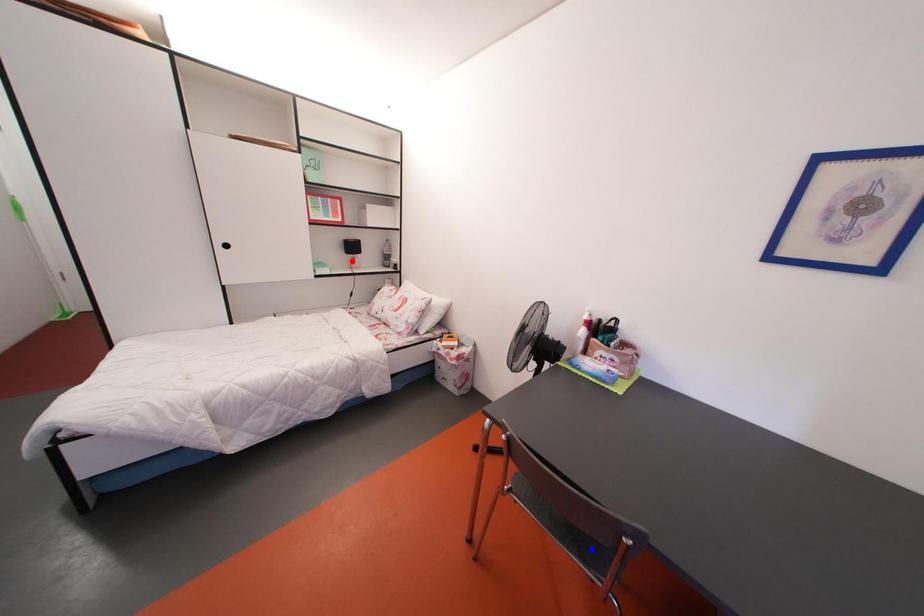
Question: In the image, two points are highlighted. Which point is nearer to the camera? Reply with the corresponding letter.

Choices:
 (A) blue point
 (B) red point

Answer: (A)